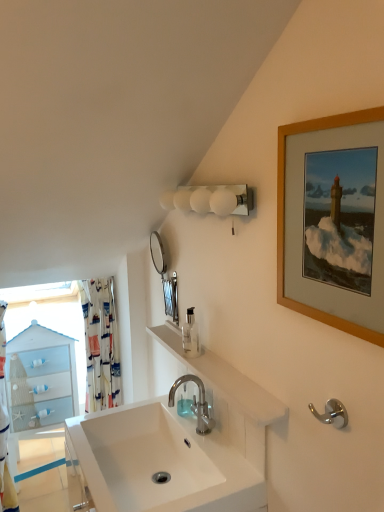
Question: From the image's perspective, is white fabric shower curtain at left, the 2th shower curtain positioned from the right, above or below silver metallic mirror at upper center?

Choices:
 (A) above
 (B) below

Answer: (B)

Question: Is white fabric shower curtain at left, the 2th shower curtain positioned from the right, bigger or smaller than silver metallic mirror at upper center?

Choices:
 (A) small
 (B) big

Answer: (B)

Question: Which of these objects is positioned closest to the printed fabric shower curtain at left, the first shower curtain when ordered from right to left?

Choices:
 (A) silver metallic mirror at upper center
 (B) polished chrome faucet at center
 (C) polished chrome hook at lower right
 (D) white frosted glass sconce at upper center
 (E) white fabric shower curtain at left, the 2th shower curtain positioned from the right

Answer: (E)

Question: Estimate the real-world distances between objects in this image. Which object is closer to the white frosted glass sconce at upper center?

Choices:
 (A) white fabric shower curtain at left, the first shower curtain when ordered from left to right
 (B) white glossy sink at center
 (C) silver metallic mirror at upper center
 (D) clear plastic soap dispenser at center
 (E) polished chrome faucet at center

Answer: (D)